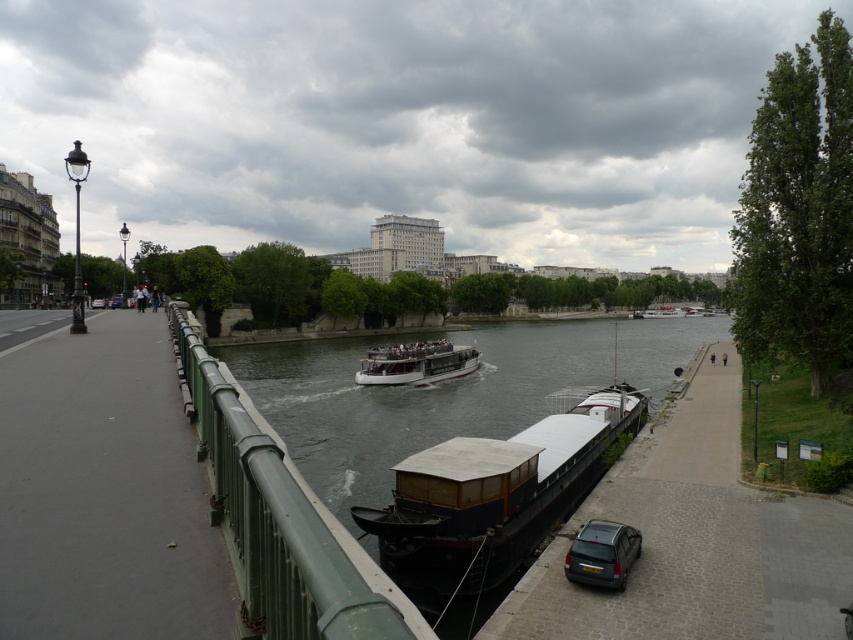
You are standing on the paved walkway bordered by a green metal railing on the left side of the image. You see a white polished wood boat at center and a point marked at coordinate (416, 364). Where is the point located?

The point at (416, 364) is located on the white polished wood boat at center.

You are a photographer standing on the riverside walkway. You want to capture a photo where the white polished wood boat at center is framed by the smooth dark water at center. Is the boat positioned in front of or behind the water in the image?

The smooth dark water at center is in front of the white polished wood boat at center, so the boat is positioned behind the water in the image.

You are standing on the walkway on the left side of the image. You want to take a photo of the white polished wood boat at center. Where should you aim your camera relative to your current position?

You should aim your camera towards the center of the image, where the white polished wood boat at center is located.